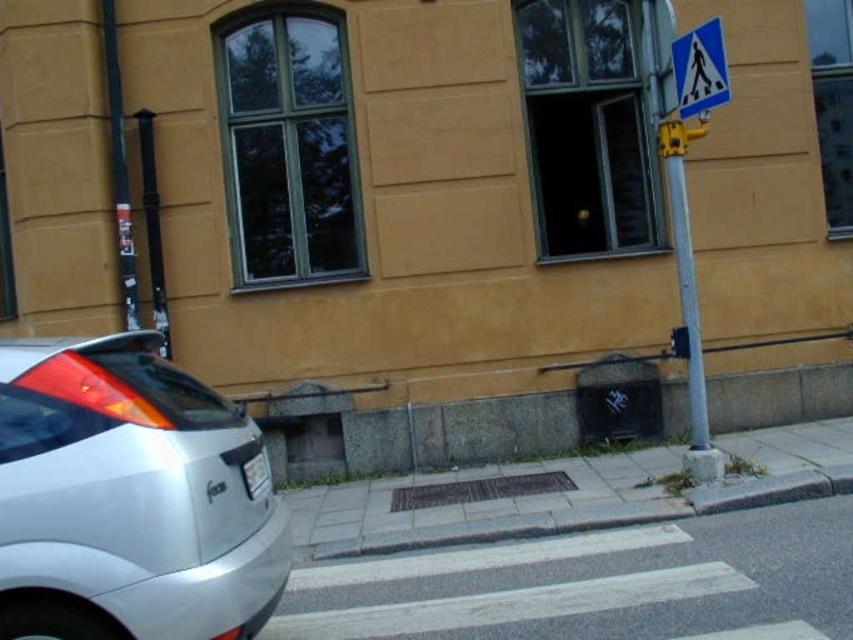
You are a delivery person trying to park your van in the space where the silver metallic hatchback at lower left is currently parked. The van is 5 meters long. Can you park there without overlapping the brass textured grate at center?

The silver metallic hatchback at lower left is positioned over the brass textured grate at center, which means the parking space is too small for a 5 meter long van. You would overlap the grate if you tried to park there.

You are standing on the sidewalk and want to take a photo of the building. There are two points marked on the car, one at coordinates point (230, 512) and another at point (440, 500). Which point will appear closer to the camera in your photo?

Point (230, 512) is closer to the viewer than point (440, 500), so it will appear closer in the photo.